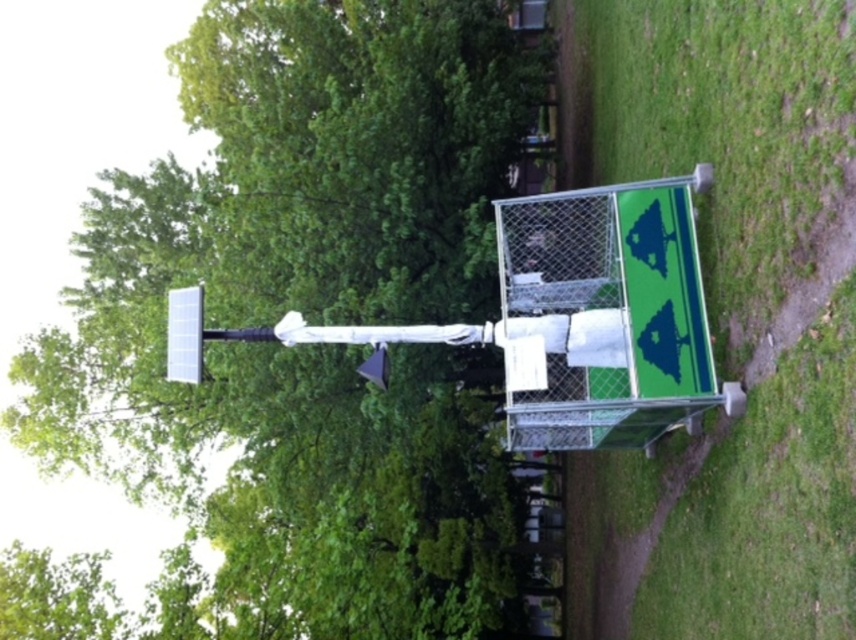
You are standing in front of the solar streetlight and the utility box. There are two points marked in the scene, one at point coordinates point (349, 72) and the other at point coordinates point (822, 236). Which point is closer to you?

Point (349, 72) is closer to you because it is further to the camera than point (822, 236).

You are a gardener standing in front of the green leafy tree at upper center and the green grass at lower right. Which one is closer to you?

The green leafy tree at upper center is closer to you because it is further to the viewer than the green grass at lower right.